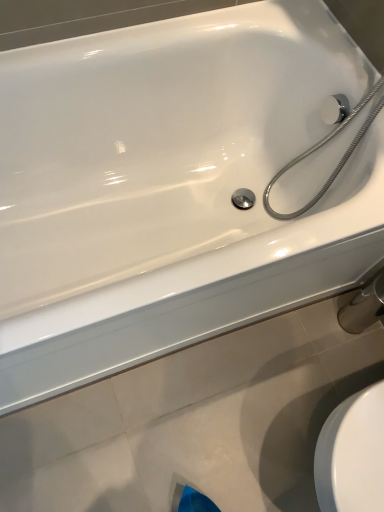
Measure the distance between chrome metallic shower head at upper right and camera.

chrome metallic shower head at upper right and camera are 37.17 inches apart from each other.

Describe the element at coordinates (320, 147) in the screenshot. I see `chrome metallic shower head at upper right` at that location.

Identify the location of chrome metallic shower head at upper right. (320, 147).

This screenshot has height=512, width=384. What do you see at coordinates (364, 307) in the screenshot?
I see `chrome metallic faucet at lower right` at bounding box center [364, 307].

Identify the location of chrome metallic faucet at lower right. (364, 307).

Where is `chrome metallic shower head at upper right`? chrome metallic shower head at upper right is located at coordinates (320, 147).

Visually, is chrome metallic shower head at upper right positioned to the left or to the right of chrome metallic faucet at lower right?

chrome metallic shower head at upper right is positioned on chrome metallic faucet at lower right's left side.

Considering the relative positions of chrome metallic shower head at upper right and chrome metallic faucet at lower right in the image provided, is chrome metallic shower head at upper right behind chrome metallic faucet at lower right?

No.

Which is nearer, (339, 164) or (377, 308)?

Point (339, 164)

From the image's perspective, is chrome metallic shower head at upper right below chrome metallic faucet at lower right?

No, from the image's perspective, chrome metallic shower head at upper right is not beneath chrome metallic faucet at lower right.

From a real-world perspective, does chrome metallic shower head at upper right stand above chrome metallic faucet at lower right?

Yes, from a real-world perspective, chrome metallic shower head at upper right is on top of chrome metallic faucet at lower right.

Is chrome metallic shower head at upper right wider or thinner than chrome metallic faucet at lower right?

chrome metallic shower head at upper right is wider than chrome metallic faucet at lower right.

Does chrome metallic shower head at upper right have a lesser height compared to chrome metallic faucet at lower right?

No.

In terms of size, does chrome metallic shower head at upper right appear bigger or smaller than chrome metallic faucet at lower right?

chrome metallic shower head at upper right is bigger than chrome metallic faucet at lower right.

Do you think chrome metallic shower head at upper right is within chrome metallic faucet at lower right, or outside of it?

chrome metallic shower head at upper right is spatially situated outside chrome metallic faucet at lower right.

Is chrome metallic shower head at upper right touching chrome metallic faucet at lower right?

chrome metallic shower head at upper right and chrome metallic faucet at lower right are not in contact.

Is chrome metallic faucet at lower right at the back of chrome metallic shower head at upper right?

That's not correct — chrome metallic shower head at upper right is not looking away from chrome metallic faucet at lower right.

This screenshot has height=512, width=384. What are the coordinates of `faucet below the chrome metallic shower head at upper right (from the image's perspective)` in the screenshot? It's located at (364, 307).

Which object is positioned more to the right, chrome metallic faucet at lower right or chrome metallic shower head at upper right?

Positioned to the right is chrome metallic faucet at lower right.

Based on the photo, which object is further away from the camera taking this photo, chrome metallic faucet at lower right or chrome metallic shower head at upper right?

chrome metallic faucet at lower right is more distant.

Considering the points (346, 324) and (324, 190), which point is in front, point (346, 324) or point (324, 190)?

Positioned in front is point (324, 190).

From the image's perspective, which object appears higher, chrome metallic faucet at lower right or chrome metallic shower head at upper right?

chrome metallic shower head at upper right is shown above in the image.

From a real-world perspective, is chrome metallic faucet at lower right beneath chrome metallic shower head at upper right?

Yes, from a real-world perspective, chrome metallic faucet at lower right is beneath chrome metallic shower head at upper right.

Can you confirm if chrome metallic faucet at lower right is wider than chrome metallic shower head at upper right?

Incorrect, the width of chrome metallic faucet at lower right does not surpass that of chrome metallic shower head at upper right.

Looking at this image, considering the relative sizes of chrome metallic faucet at lower right and chrome metallic shower head at upper right in the image provided, is chrome metallic faucet at lower right shorter than chrome metallic shower head at upper right?

Indeed, chrome metallic faucet at lower right has a lesser height compared to chrome metallic shower head at upper right.

Looking at this image, which of these two, chrome metallic faucet at lower right or chrome metallic shower head at upper right, is smaller?

With smaller size is chrome metallic faucet at lower right.

Does chrome metallic faucet at lower right contain chrome metallic shower head at upper right?

No, chrome metallic shower head at upper right is not surrounded by chrome metallic faucet at lower right.

In the scene shown: Is chrome metallic faucet at lower right far away from chrome metallic shower head at upper right?

No, chrome metallic faucet at lower right is in close proximity to chrome metallic shower head at upper right.

Is chrome metallic faucet at lower right oriented towards chrome metallic shower head at upper right?

No, chrome metallic faucet at lower right does not turn towards chrome metallic shower head at upper right.

This screenshot has width=384, height=512. Identify the location of faucet below the chrome metallic shower head at upper right (from the image's perspective). (364, 307).

Where is `shower in front of the chrome metallic faucet at lower right`? Image resolution: width=384 pixels, height=512 pixels. shower in front of the chrome metallic faucet at lower right is located at coordinates (320, 147).

The width and height of the screenshot is (384, 512). I want to click on shower above the chrome metallic faucet at lower right (from a real-world perspective), so click(320, 147).